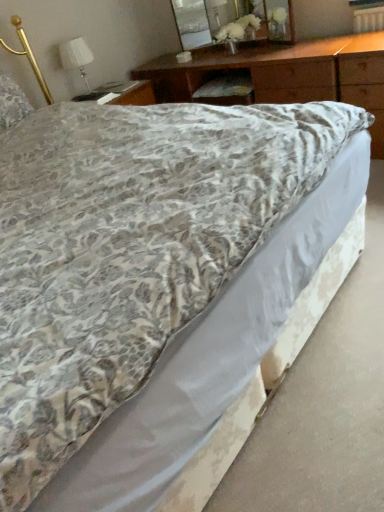
Question: Is wooden at upper center at the left side of fluffy white pillow at upper left?

Choices:
 (A) no
 (B) yes

Answer: (A)

Question: Is wooden at upper center smaller than fluffy white pillow at upper left?

Choices:
 (A) yes
 (B) no

Answer: (B)

Question: Would you consider wooden at upper center to be distant from fluffy white pillow at upper left?

Choices:
 (A) no
 (B) yes

Answer: (B)

Question: Considering the relative sizes of wooden at upper center and fluffy white pillow at upper left in the image provided, is wooden at upper center shorter than fluffy white pillow at upper left?

Choices:
 (A) yes
 (B) no

Answer: (B)

Question: Does wooden at upper center have a lesser width compared to fluffy white pillow at upper left?

Choices:
 (A) no
 (B) yes

Answer: (A)

Question: Considering the positions of white fabric lampshade at upper left and fluffy white pillow at upper left in the image, is white fabric lampshade at upper left taller or shorter than fluffy white pillow at upper left?

Choices:
 (A) short
 (B) tall

Answer: (B)

Question: Relative to fluffy white pillow at upper left, is white fabric lampshade at upper left in front or behind?

Choices:
 (A) front
 (B) behind

Answer: (B)

Question: From a real-world perspective, is white fabric lampshade at upper left positioned above or below fluffy white pillow at upper left?

Choices:
 (A) above
 (B) below

Answer: (B)

Question: Is white fabric lampshade at upper left wider or thinner than fluffy white pillow at upper left?

Choices:
 (A) thin
 (B) wide

Answer: (A)

Question: Is point (16, 90) closer or farther from the camera than point (87, 49)?

Choices:
 (A) farther
 (B) closer

Answer: (B)

Question: In terms of size, does fluffy white pillow at upper left appear bigger or smaller than white fabric lampshade at upper left?

Choices:
 (A) big
 (B) small

Answer: (A)

Question: Is fluffy white pillow at upper left wider or thinner than white fabric lampshade at upper left?

Choices:
 (A) thin
 (B) wide

Answer: (B)

Question: Would you say fluffy white pillow at upper left is to the left or to the right of white fabric lampshade at upper left in the picture?

Choices:
 (A) right
 (B) left

Answer: (B)

Question: Visually, is clear glass mirror at upper center positioned to the left or to the right of white fabric lampshade at upper left?

Choices:
 (A) right
 (B) left

Answer: (A)

Question: Is clear glass mirror at upper center wider or thinner than white fabric lampshade at upper left?

Choices:
 (A) wide
 (B) thin

Answer: (B)